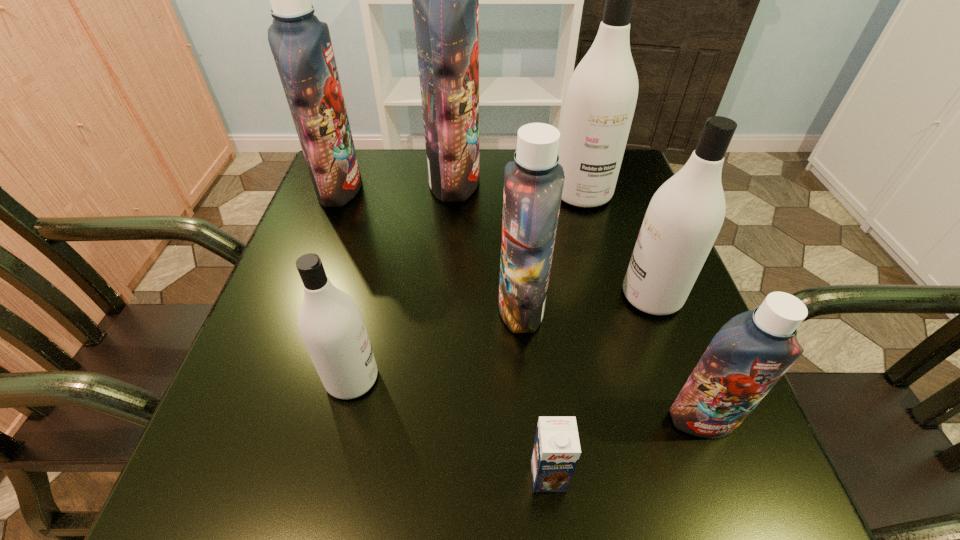
Identify the location of free region located 0.070m on the front-facing side of the second farthest white shampoo. (586, 296).

Locate an element on the screen. The width and height of the screenshot is (960, 540). free spot located on the front-facing side of the second farthest white shampoo is located at coordinates (503, 296).

Locate an element on the screen. The width and height of the screenshot is (960, 540). vacant space located on the front-facing side of the second farthest white shampoo is located at coordinates (529, 296).

Find the location of a particular element. vacant area situated 0.130m on the front-facing side of the smallest white shampoo is located at coordinates (457, 379).

Where is `vacant space located 0.050m on the front label of the smallest blue shampoo`? The height and width of the screenshot is (540, 960). vacant space located 0.050m on the front label of the smallest blue shampoo is located at coordinates (723, 474).

Find the location of a particular element. object that is at the near edge is located at coordinates (556, 450).

The width and height of the screenshot is (960, 540). Find the location of `object at the far left corner`. object at the far left corner is located at coordinates (301, 45).

This screenshot has height=540, width=960. Identify the location of object present at the far right corner. (601, 97).

At what (x,y) coordinates should I click in order to perform the action: click on vacant space at the far edge. Please return your answer as a coordinate pair (x, y). Image resolution: width=960 pixels, height=540 pixels. Looking at the image, I should click on (502, 168).

Locate an element on the screen. Image resolution: width=960 pixels, height=540 pixels. vacant area at the near edge is located at coordinates (524, 482).